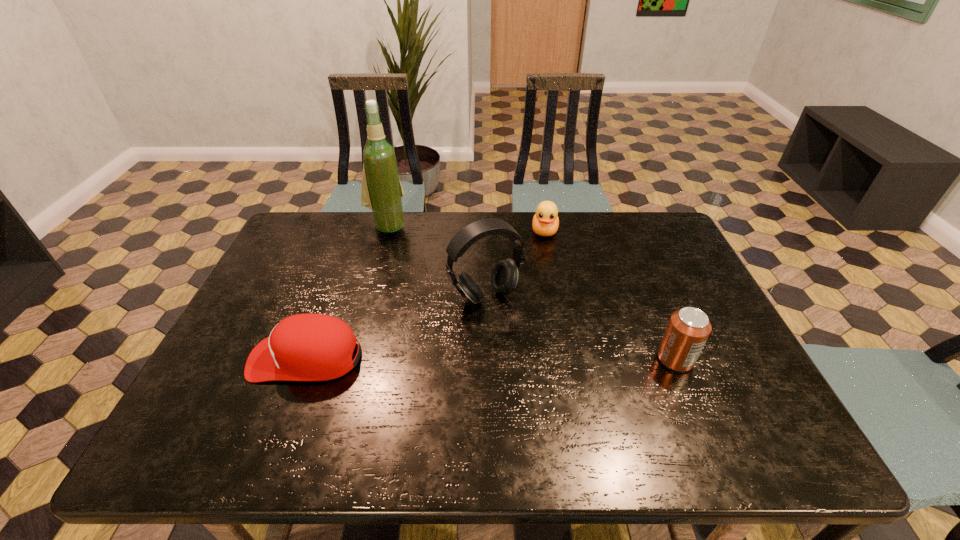
Where is `vacant space situated on the front-facing side of the wine bottle`? vacant space situated on the front-facing side of the wine bottle is located at coordinates pyautogui.click(x=405, y=265).

Find the location of `free point located 0.210m on the ear cups of the fourth shortest object`. free point located 0.210m on the ear cups of the fourth shortest object is located at coordinates (543, 370).

The height and width of the screenshot is (540, 960). I want to click on vacant space situated 0.310m on the ear cups of the fourth shortest object, so click(567, 404).

This screenshot has height=540, width=960. I want to click on vacant region located on the ear cups of the fourth shortest object, so click(522, 341).

Image resolution: width=960 pixels, height=540 pixels. I want to click on vacant space located on the face of the duckling, so click(543, 254).

This screenshot has width=960, height=540. Identify the location of blank area located 0.180m on the face of the duckling. (540, 279).

Find the location of `vacant space situated on the face of the duckling`. vacant space situated on the face of the duckling is located at coordinates (540, 284).

This screenshot has width=960, height=540. In order to click on wine bottle that is positioned at the far edge in this screenshot , I will do `click(381, 190)`.

Identify the location of duckling at the far edge. The width and height of the screenshot is (960, 540). (545, 222).

At what (x,y) coordinates should I click in order to perform the action: click on object located at the near edge. Please return your answer as a coordinate pair (x, y). Image resolution: width=960 pixels, height=540 pixels. Looking at the image, I should click on point(305,347).